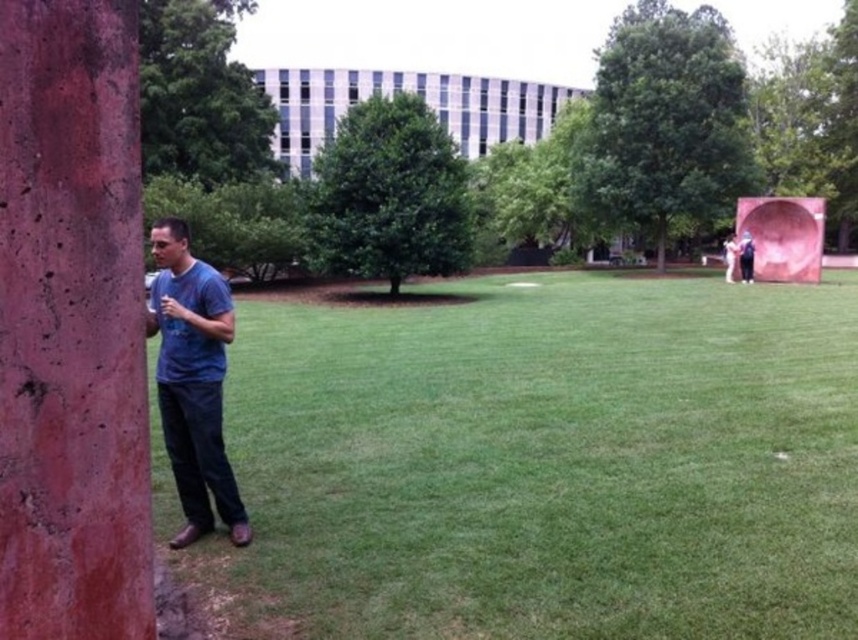
From the picture: You are standing in the outdoor area and want to take a photo of the white matte statue at upper right without the green grass at lower center blocking the view. What should you do?

Move backward to position yourself further away from the green grass at lower center so that the white matte statue at upper right becomes visible without obstruction.

You are an architect designing a new park layout. You want to place a bench between the green leafy tree at upper right and the white matte statue at upper right. Which side of the bench should face the wider object?

The green leafy tree at upper right has a larger width than the white matte statue at upper right. Therefore, the bench should be positioned so that its wider side faces the green leafy tree at upper right.